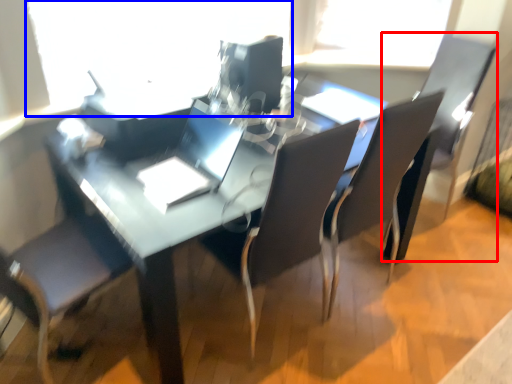
Question: Which object is closer to the camera taking this photo, armchair (highlighted by a red box) or window screen (highlighted by a blue box)?

Choices:
 (A) armchair
 (B) window screen

Answer: (B)